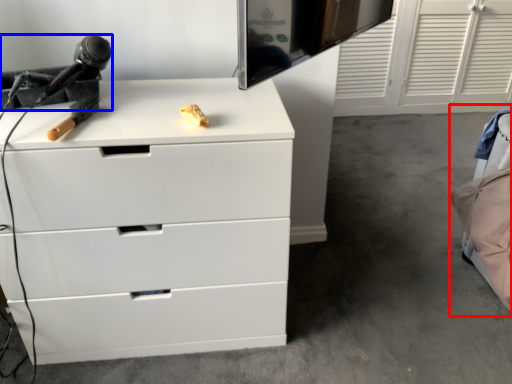
Question: Which object appears closest to the camera in this image, bed (highlighted by a red box) or equipment (highlighted by a blue box)?

Choices:
 (A) bed
 (B) equipment

Answer: (B)